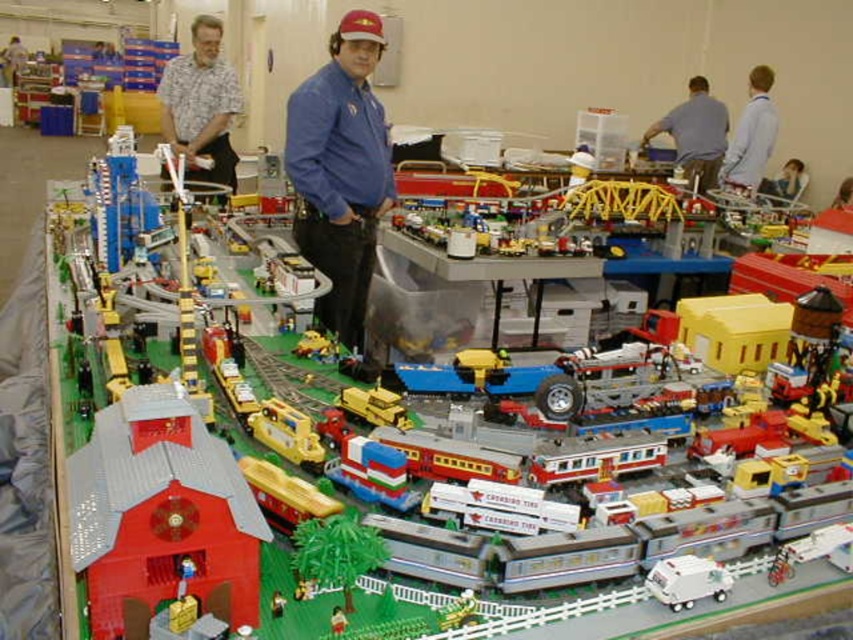
You are standing in front of the Lego train set display and want to touch both points marked in the image. Which point, point (167, 129) or point (15, 54), will you reach first if you move towards them directly?

Point (167, 129) is closer to the camera than point (15, 54), so you will reach point (167, 129) first.

What is the 2D coordinate of the brushed metal shirt at upper left in the Lego model train set?

The 2D coordinate of the brushed metal shirt at upper left is at point [201,106].

You are a photographer standing in the Lego train set scene. You want to take a picture that includes both the gray fabric shirt at upper right and the brushed metal water at bottle left. Is it possible to capture both in a single frame without moving your position?

The gray fabric shirt at upper right and the brushed metal water at bottle left are 16.03 meters apart from each other. Since this distance is quite large, it might be challenging to capture both in a single frame without moving your position. However, using a wide angle lens could potentially include both objects in the shot.